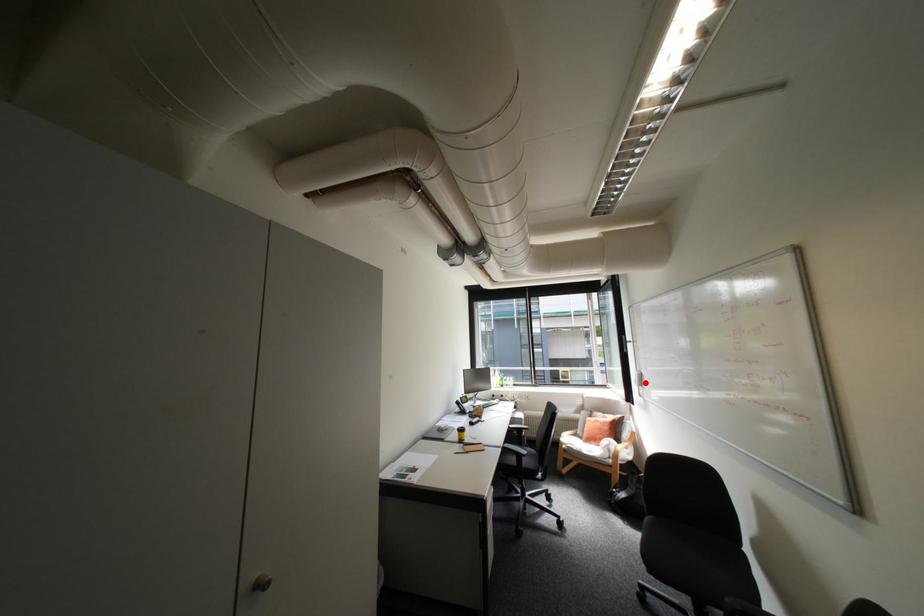
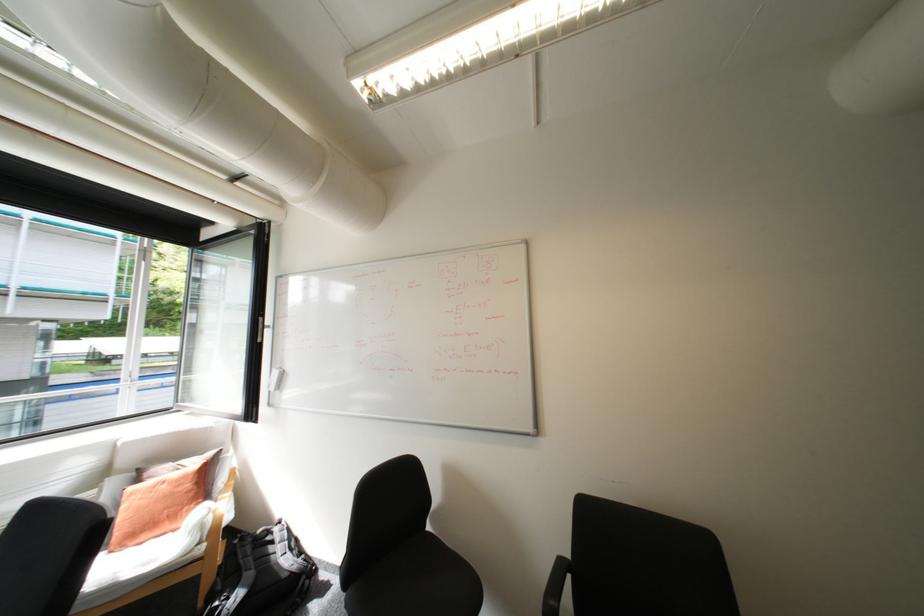
Question: I am providing you with two images of the same scene from different viewpoints. In image1, a red point is highlighted. Considering the same 3D point in image2, which of the following is correct?

Choices:
 (A) It is closer
 (B) It is farther

Answer: (B)